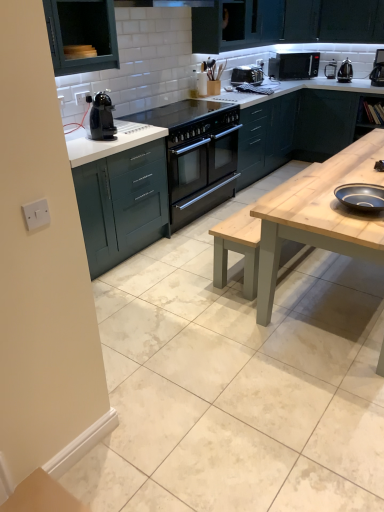
Locate an element on the screen. This screenshot has height=512, width=384. blank space to the left of black plastic coffee machine at upper left is located at coordinates (84, 139).